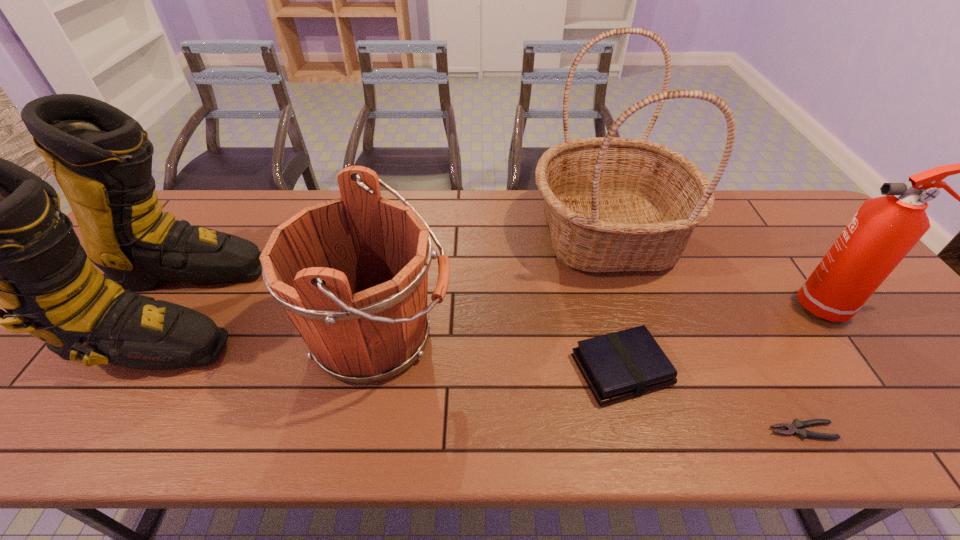
At what (x,y) coordinates should I click in order to perform the action: click on free space between the shortest object and the leftmost object. Please return your answer as a coordinate pair (x, y). Image resolution: width=960 pixels, height=540 pixels. Looking at the image, I should click on (486, 370).

Locate an element on the screen. free spot between the second object from left to right and the ski boots is located at coordinates (275, 323).

Find the location of a particular element. empty location between the pliers and the leftmost object is located at coordinates (486, 370).

Image resolution: width=960 pixels, height=540 pixels. I want to click on blank region between the fifth tallest object and the pliers, so click(711, 400).

Identify the location of free space between the rightmost object and the ski boots. Image resolution: width=960 pixels, height=540 pixels. (501, 308).

You are a GUI agent. You are given a task and a screenshot of the screen. Output one action in this format:
    pyautogui.click(x=<x>, y=<y>)
    Task: Click on the object that can be found as the second closest to the fire extinguisher
    The height and width of the screenshot is (540, 960).
    Given the screenshot: What is the action you would take?
    pyautogui.click(x=795, y=428)

Point out which object is positioned as the fifth nearest to the fifth object from right to left. Please provide its 2D coordinates. Your answer should be formatted as a tuple, i.e. [(x, y)], where the tuple contains the x and y coordinates of a point satisfying the conditions above.

[(883, 231)]

Locate an element on the screen. free space that satisfies the following two spatial constraints: 1. with the handle on the side of the second object from left to right; 2. on the back side of the book is located at coordinates (372, 369).